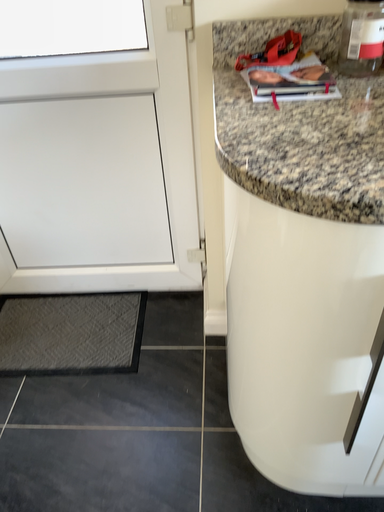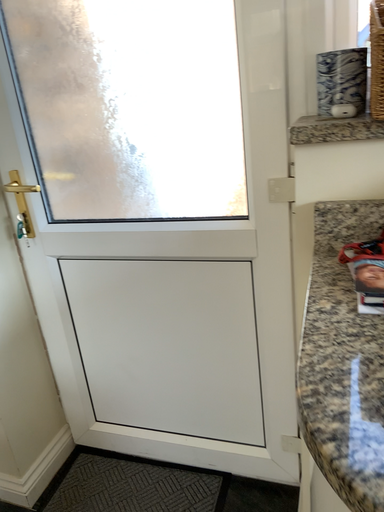
Question: How did the camera likely rotate when shooting the video?

Choices:
 (A) rotated right
 (B) rotated left

Answer: (B)